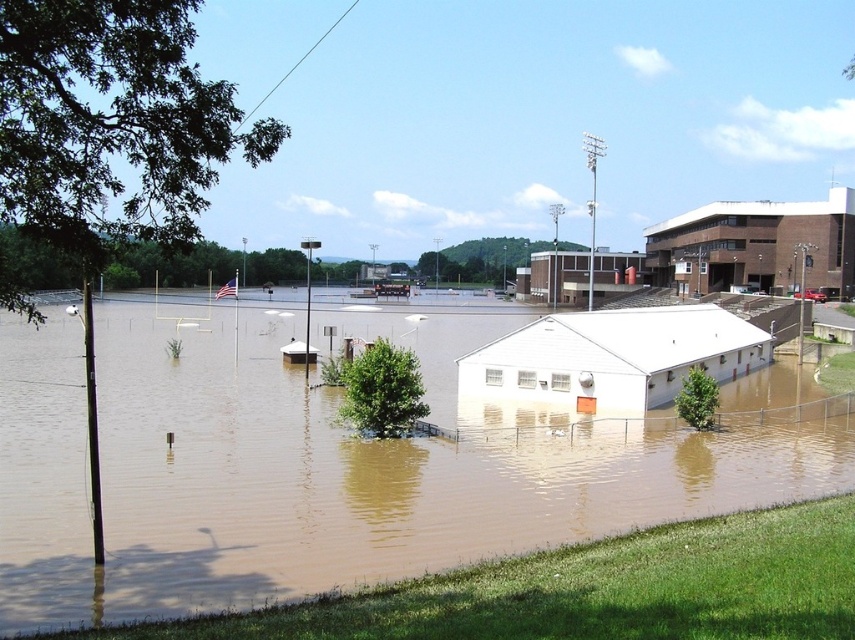
Question: Does brown muddy flood at center appear on the right side of white matte building at center?

Choices:
 (A) no
 (B) yes

Answer: (A)

Question: Which point is closer to the camera taking this photo?

Choices:
 (A) (534, 358)
 (B) (275, 536)

Answer: (B)

Question: Which point is farther to the camera?

Choices:
 (A) white matte building at center
 (B) brown muddy flood at center

Answer: (A)

Question: Does brown muddy flood at center have a smaller size compared to white matte building at center?

Choices:
 (A) no
 (B) yes

Answer: (A)

Question: Does brown muddy flood at center appear over white matte building at center?

Choices:
 (A) yes
 (B) no

Answer: (B)

Question: Which object appears closest to the camera in this image?

Choices:
 (A) brown muddy flood at center
 (B) white matte building at center

Answer: (A)